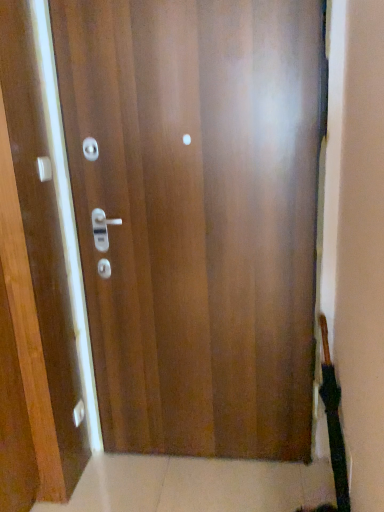
This screenshot has width=384, height=512. What do you see at coordinates (78, 413) in the screenshot?
I see `matte silver knob at lower left` at bounding box center [78, 413].

Image resolution: width=384 pixels, height=512 pixels. What are the coordinates of `glossy wood door at center` in the screenshot? It's located at coord(197,216).

How different are the orientations of glossy wood door at center and matte silver knob at lower left in degrees?

The angular difference between glossy wood door at center and matte silver knob at lower left is 91.4 degrees.

Is glossy wood door at center bigger or smaller than matte silver knob at lower left?

glossy wood door at center is bigger than matte silver knob at lower left.

Can you confirm if glossy wood door at center is positioned to the left of matte silver knob at lower left?

Incorrect, glossy wood door at center is not on the left side of matte silver knob at lower left.

From a real-world perspective, which object stands above the other?

From a 3D spatial view, glossy wood door at center is above.

Between glossy wood door at center and matte white handle at upper left, which one has more height?

With more height is glossy wood door at center.

Does glossy wood door at center touch matte white handle at upper left?

They are not placed beside each other.

From a real-world perspective, which is physically above, glossy wood door at center or matte white handle at upper left?

matte white handle at upper left.

Considering the sizes of objects glossy wood door at center and matte white handle at upper left in the image provided, who is bigger, glossy wood door at center or matte white handle at upper left?

Bigger between the two is glossy wood door at center.

Could you tell me if matte silver knob at lower left is turned towards glossy wood door at center?

No, matte silver knob at lower left is not turned towards glossy wood door at center.

Which is behind, matte silver knob at lower left or glossy wood door at center?

matte silver knob at lower left is further from the camera.

How much distance is there between matte silver knob at lower left and glossy wood door at center?

matte silver knob at lower left is 1.06 meters from glossy wood door at center.

Is matte white handle at upper left far from matte silver knob at lower left?

Yes, matte white handle at upper left is far from matte silver knob at lower left.

Considering the sizes of objects matte white handle at upper left and matte silver knob at lower left in the image provided, who is wider, matte white handle at upper left or matte silver knob at lower left?

matte white handle at upper left is wider.

Considering the relative positions of matte white handle at upper left and matte silver knob at lower left in the image provided, is matte white handle at upper left behind matte silver knob at lower left?

No, matte white handle at upper left is in front of matte silver knob at lower left.

Can you tell me how much matte white handle at upper left and matte silver knob at lower left differ in facing direction?

1.75 degrees separate the facing orientations of matte white handle at upper left and matte silver knob at lower left.

Is matte silver knob at lower left looking in the opposite direction of matte white handle at upper left?

No.

Is matte silver knob at lower left shorter than matte white handle at upper left?

No.

Visually, is matte silver knob at lower left positioned to the left or to the right of matte white handle at upper left?

In the image, matte silver knob at lower left appears on the right side of matte white handle at upper left.

The width and height of the screenshot is (384, 512). I want to click on knob on the right of matte white handle at upper left, so click(x=78, y=413).

Between matte white handle at upper left and glossy wood door at center, which one has larger width?

glossy wood door at center is wider.

Looking at this image, which of these two, matte white handle at upper left or glossy wood door at center, is bigger?

With larger size is glossy wood door at center.

Does point (40, 162) come farther from viewer compared to point (198, 115)?

Yes, point (40, 162) is farther from viewer.

The height and width of the screenshot is (512, 384). Find the location of `door above the matte silver knob at lower left (from a real-world perspective)`. door above the matte silver knob at lower left (from a real-world perspective) is located at coordinates (197, 216).

Image resolution: width=384 pixels, height=512 pixels. Find the location of `handle above the glossy wood door at center (from the image's perspective)`. handle above the glossy wood door at center (from the image's perspective) is located at coordinates (44, 169).

From the picture: Considering their positions, is glossy wood door at center positioned further to matte silver knob at lower left than matte white handle at upper left?

glossy wood door at center is further to matte silver knob at lower left.

From the image, which object appears to be farther from glossy wood door at center, matte silver knob at lower left or matte white handle at upper left?

Among the two, matte silver knob at lower left is located further to glossy wood door at center.

Which object lies further to the anchor point matte white handle at upper left, glossy wood door at center or matte silver knob at lower left?

matte silver knob at lower left.

Based on the photo, based on their spatial positions, is matte white handle at upper left or matte silver knob at lower left closer to glossy wood door at center?

matte white handle at upper left lies closer to glossy wood door at center than the other object.

When comparing their distances from matte silver knob at lower left, does matte white handle at upper left or glossy wood door at center seem closer?

matte white handle at upper left is closer to matte silver knob at lower left.

Considering their positions, is matte silver knob at lower left positioned closer to matte white handle at upper left than glossy wood door at center?

glossy wood door at center lies closer to matte white handle at upper left than the other object.

You are a GUI agent. You are given a task and a screenshot of the screen. Output one action in this format:
    pyautogui.click(x=<x>, y=<y>)
    Task: Click on the door that lies between matte white handle at upper left and matte silver knob at lower left from top to bottom
    
    Given the screenshot: What is the action you would take?
    pyautogui.click(x=197, y=216)